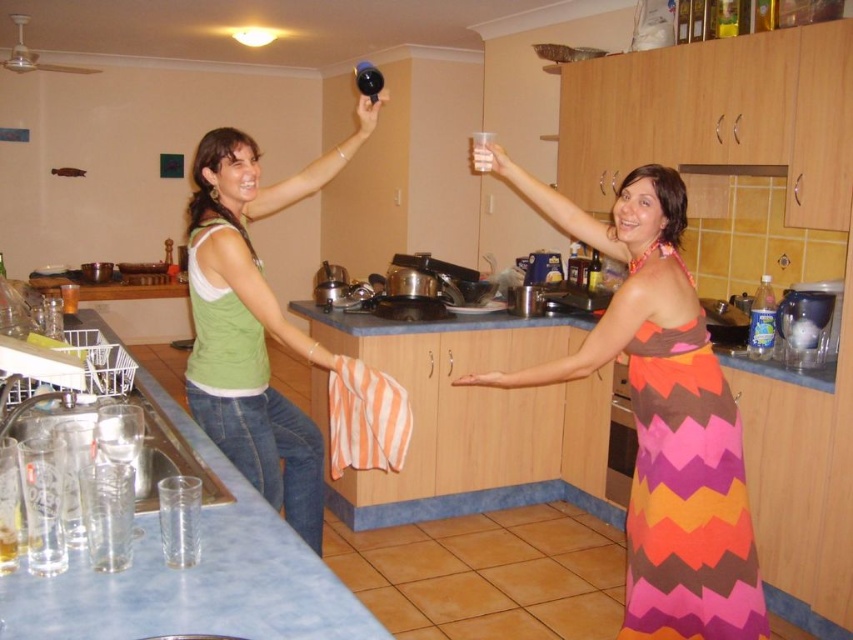
You are a fashion designer analyzing the image of a kitchen scene. You need to note the exact location of the green fabric tank top at upper left. What are the coordinates of its position?

The coordinates of the green fabric tank top at upper left are at point (251, 326).

In the scene shown: You are a photographer trying to capture a candid shot of the two women in the kitchen. You notice the green fabric tank top at upper left and the pink fabric hand at center. Which object should you focus on first if you want to prioritize the one that is taller?

The green fabric tank top at upper left has a greater height compared to the pink fabric hand at center, so you should focus on the green fabric tank top at upper left first.